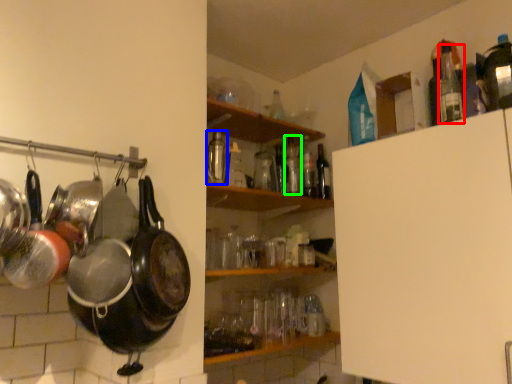
Question: Estimate the real-world distances between objects in this image. Which object is farther from bottle (highlighted by a red box), bottle (highlighted by a blue box) or bottle (highlighted by a green box)?

Choices:
 (A) bottle
 (B) bottle

Answer: (A)